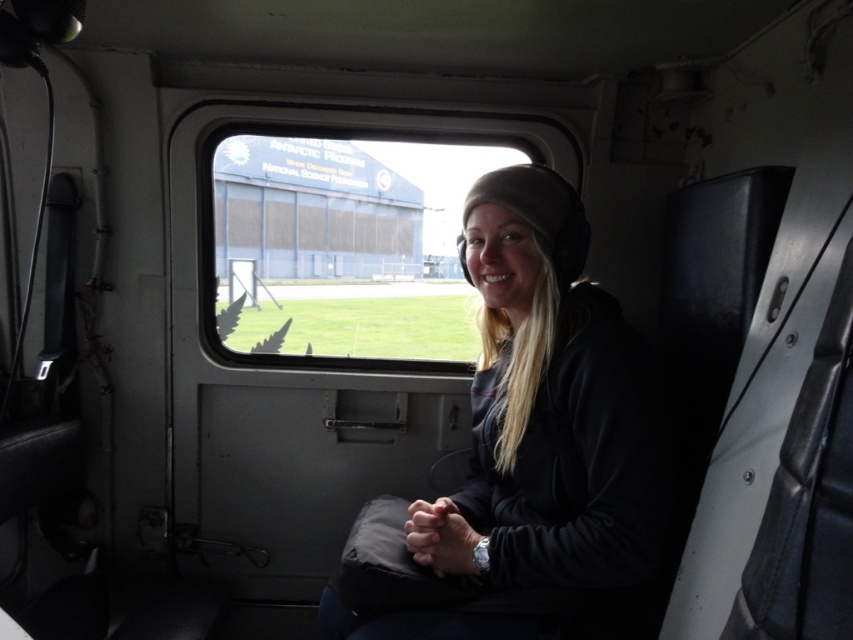
The height and width of the screenshot is (640, 853). What do you see at coordinates (541, 435) in the screenshot? I see `black fleece jacket at center` at bounding box center [541, 435].

Between point (494, 296) and point (444, 243), which one is positioned behind?

Point (444, 243)

Between point (642, 492) and point (326, 180), which one is positioned behind?

Positioned behind is point (326, 180).

Where is `black fleece jacket at center`? black fleece jacket at center is located at coordinates (541, 435).